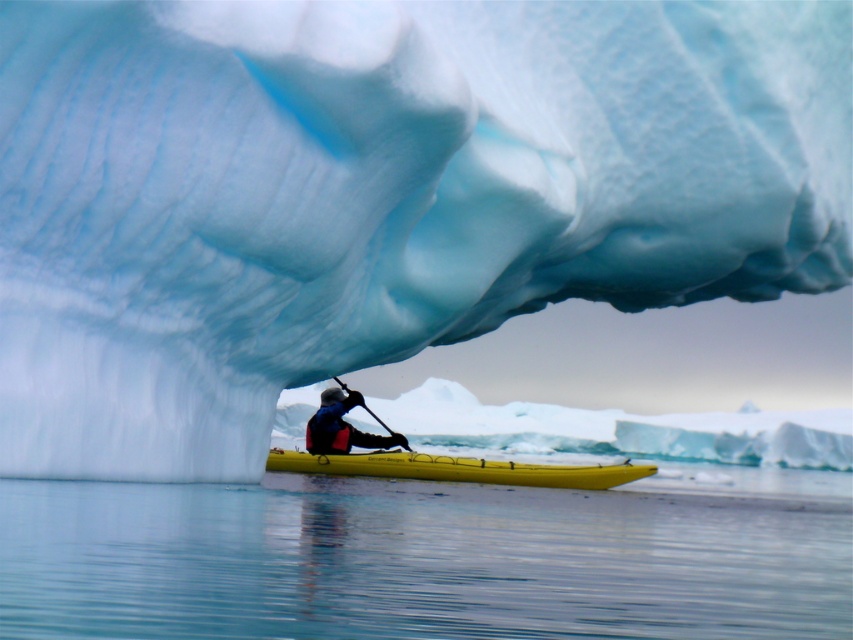
Question: Which is nearer to the yellow matte canoe at center?

Choices:
 (A) black rubber paddle at center
 (B) transparent water at lower center

Answer: (A)

Question: Which object appears farthest from the camera in this image?

Choices:
 (A) black rubber paddle at center
 (B) transparent water at lower center

Answer: (A)

Question: From the image, what is the correct spatial relationship of transparent water at lower center in relation to black rubber paddle at center?

Choices:
 (A) right
 (B) left

Answer: (A)

Question: Which of the following is the farthest from the observer?

Choices:
 (A) transparent water at lower center
 (B) black rubber paddle at center

Answer: (B)

Question: Does yellow matte canoe at center lie in front of black rubber paddle at center?

Choices:
 (A) yes
 (B) no

Answer: (A)

Question: Does yellow matte canoe at center appear on the right side of black rubber paddle at center?

Choices:
 (A) no
 (B) yes

Answer: (B)